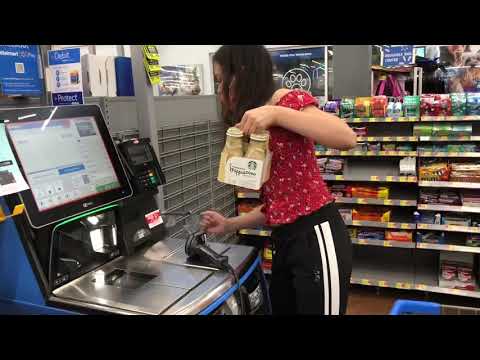
Find the location of `rack of candy and gum`. rack of candy and gum is located at coordinates (424, 161).